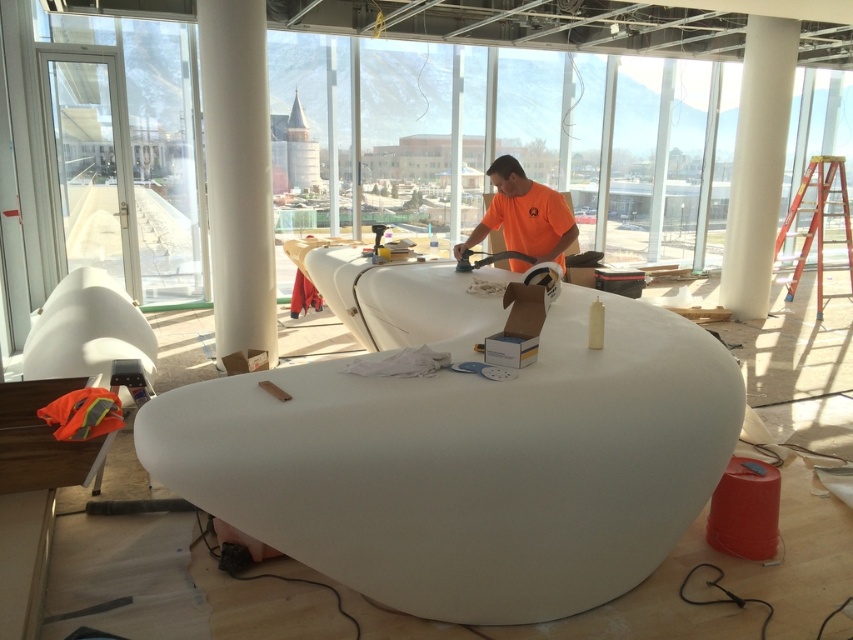
Looking at this image, which of these two, white smooth pillar at center or orange matte shirt at center, stands shorter?

orange matte shirt at center

Between point (234, 209) and point (527, 241), which one is positioned behind?

Point (234, 209)

Find the location of a particular element. This screenshot has width=853, height=640. white smooth pillar at center is located at coordinates (236, 173).